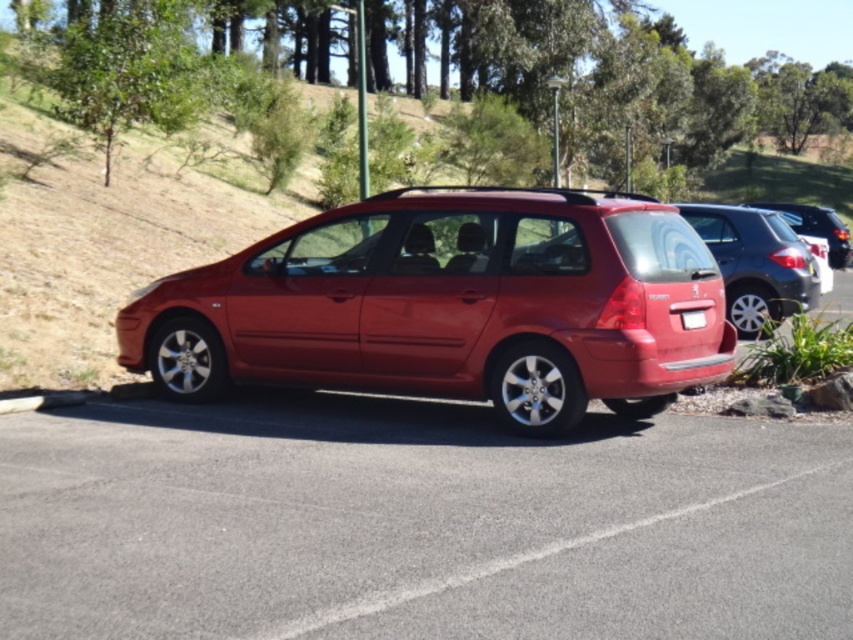
You are a photographer trying to capture the glossy metallic car at right and the white plastic license plate at center in a single shot. Since you want both objects to be in focus, which one should you focus on first to ensure depth of field?

You should focus on the white plastic license plate at center first because it is closer to the camera than the glossy metallic car at right, allowing the depth of field to extend backward to include both objects in focus.

You are a photographer trying to capture the glossy metallic car at right and the white plastic license plate at center in a single frame. Based on their sizes, which object should you focus on first to ensure both are clearly visible in your photo?

The glossy metallic car at right is wider than the white plastic license plate at center, so you should focus on the glossy metallic car at right first to ensure both are clearly visible in the photo.

You are a photographer trying to capture the glossy metallic car at right and the white plastic license plate at center in a single shot. Since the car is taller than the license plate, which object should you focus on first to ensure both are in frame?

The glossy metallic car at right is taller than the white plastic license plate at center. To ensure both are in frame, focus on the taller object first, which is the glossy metallic car at right, then adjust the camera angle to include the white plastic license plate at center.